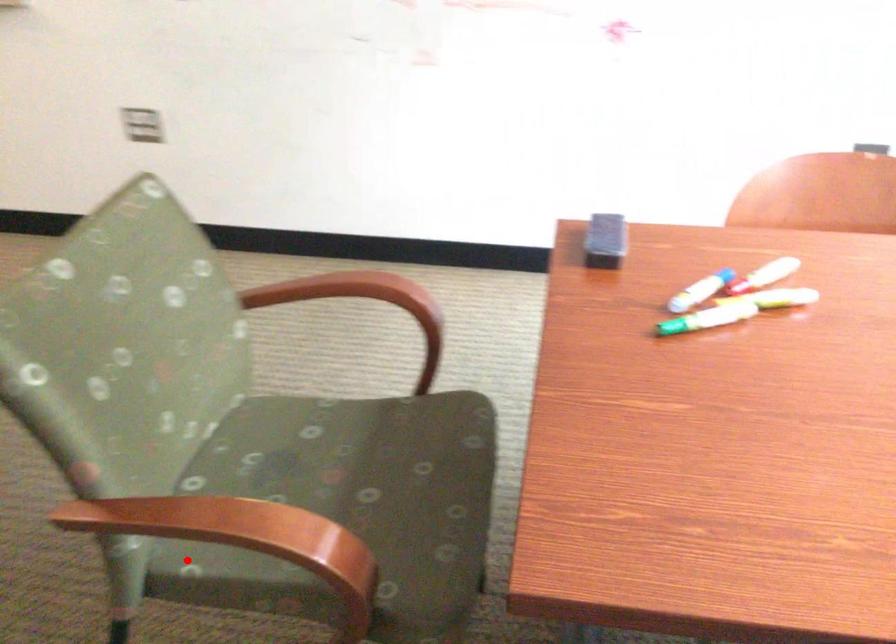
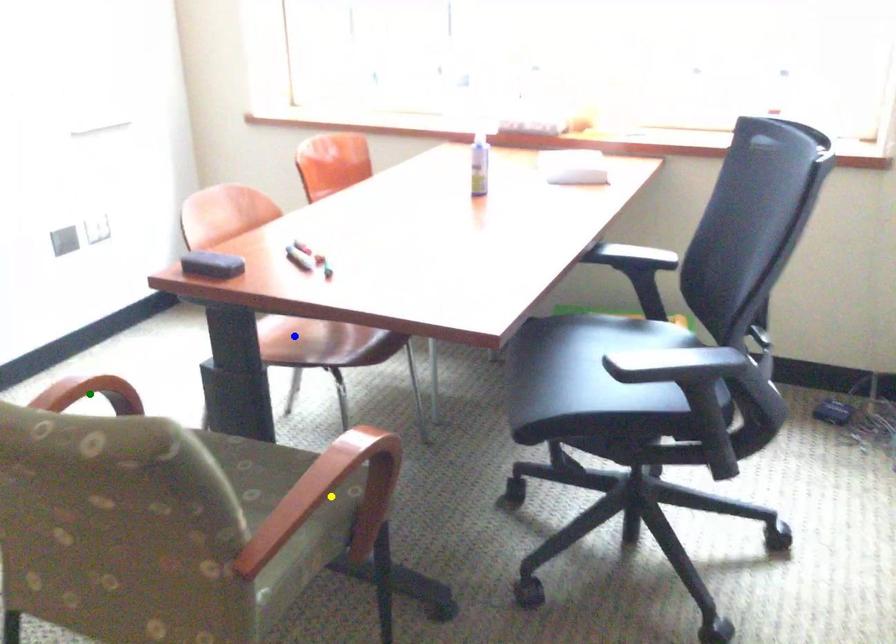
Question: I am providing you with two images of the same scene from different viewpoints. A red point is marked on the first image. You are given multiple points on the second image. Can you choose the point in image 2 that corresponds to the point in image 1?

Choices:
 (A) green point
 (B) yellow point
 (C) blue point

Answer: (B)